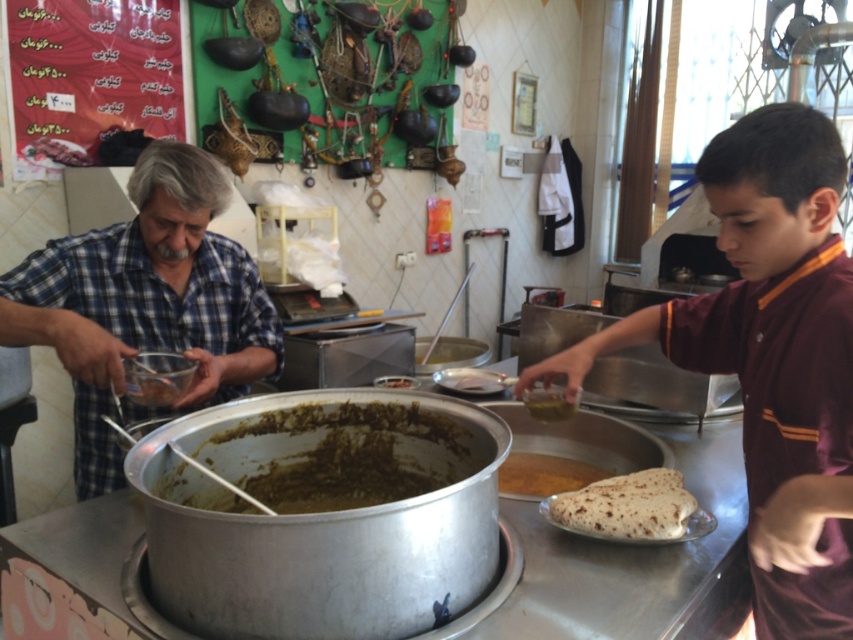
Who is more distant from viewer, (778, 285) or (550, 484)?

Positioned behind is point (550, 484).

Describe the element at coordinates (770, 356) in the screenshot. I see `maroon uniform at right` at that location.

At what (x,y) coordinates should I click in order to perform the action: click on maroon uniform at right. Please return your answer as a coordinate pair (x, y). This screenshot has width=853, height=640. Looking at the image, I should click on (770, 356).

Locate an element on the screen. blue plaid shirt at left is located at coordinates (144, 301).

Between blue plaid shirt at left and greenish-brown paste at center, which one is positioned lower?

greenish-brown paste at center is lower down.

Where is `blue plaid shirt at left`? The image size is (853, 640). blue plaid shirt at left is located at coordinates (144, 301).

Between point (323, 417) and point (550, 404), which one is positioned in front?

Point (323, 417)

Who is lower down, greenish-brown paste at center or green matte oil at center?

greenish-brown paste at center is below.

Is point (442, 464) farther from viewer compared to point (558, 394)?

That is False.

I want to click on greenish-brown paste at center, so click(334, 458).